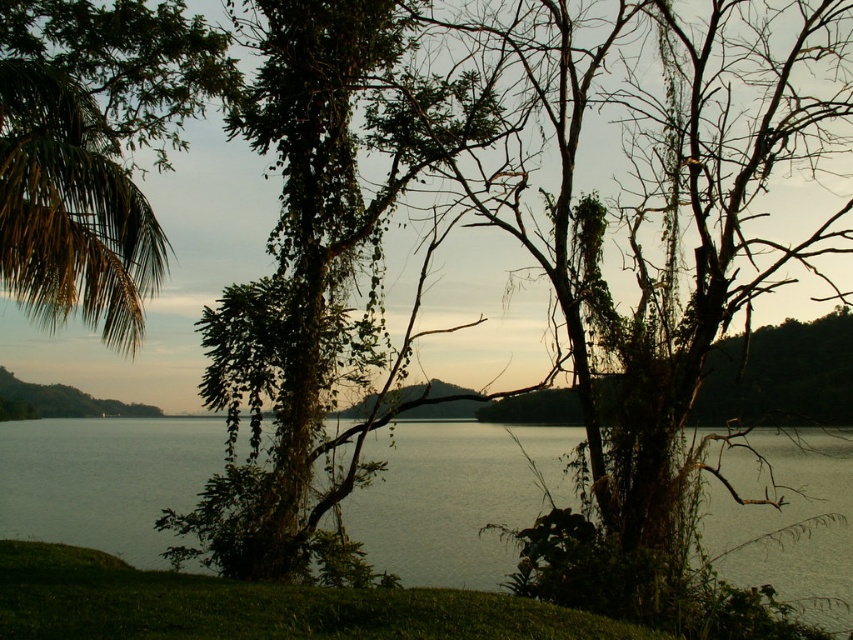
Consider the image. Does greenish water at center have a greater width compared to green leafy palm at upper left?

Indeed, greenish water at center has a greater width compared to green leafy palm at upper left.

Which of these two, greenish water at center or green leafy palm at upper left, stands shorter?

With less height is greenish water at center.

Who is more forward, (778, 577) or (9, 182)?

Point (778, 577) is more forward.

Find the location of a particular element. This screenshot has width=853, height=640. greenish water at center is located at coordinates (456, 497).